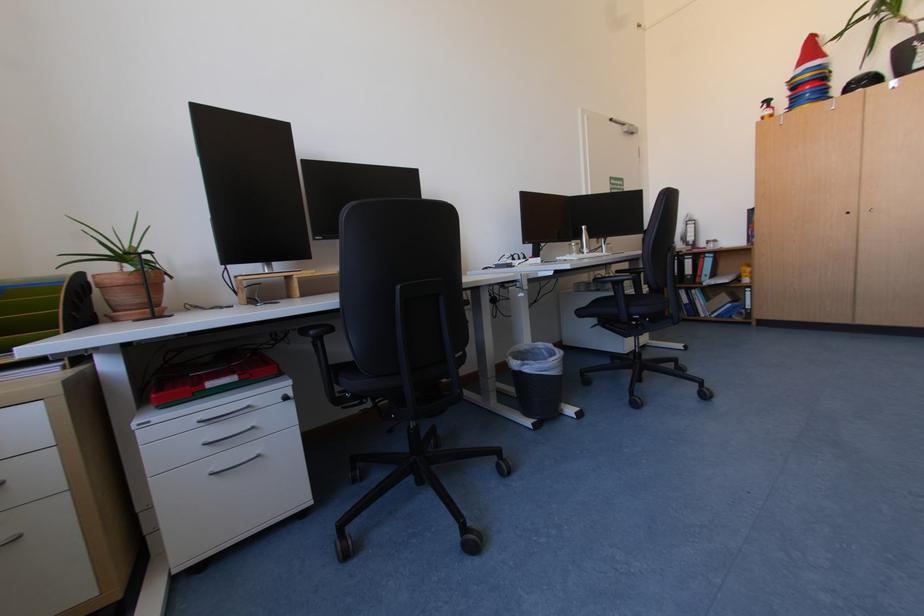
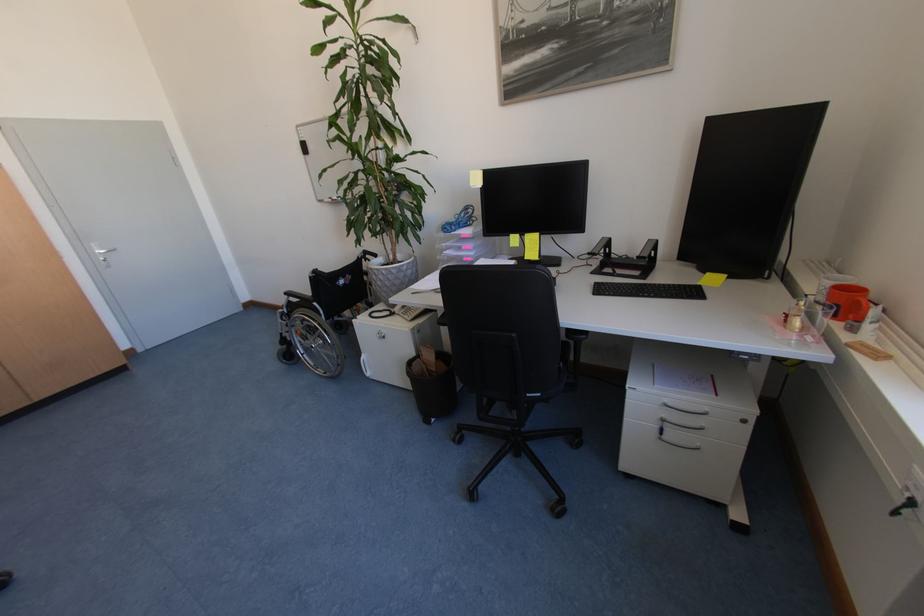
The images are taken continuously from a first-person perspective. In which direction is your viewpoint rotating?

The camera rotated toward right-down.